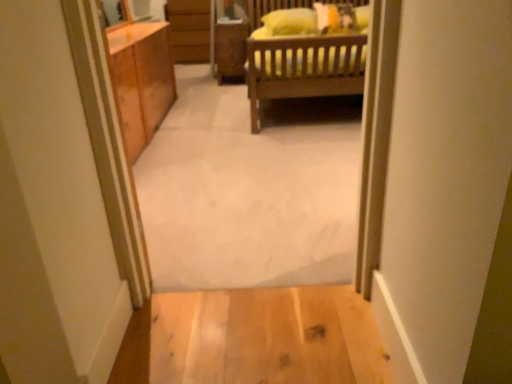
The width and height of the screenshot is (512, 384). I want to click on wooden cabinet at center, so click(230, 50).

Locate an element on the screen. Image resolution: width=512 pixels, height=384 pixels. light wood floor at lower center, the 2th plain viewed from the top is located at coordinates (266, 337).

Image resolution: width=512 pixels, height=384 pixels. Describe the element at coordinates (249, 189) in the screenshot. I see `carpet at center, the first plain positioned from the top` at that location.

You are a GUI agent. You are given a task and a screenshot of the screen. Output one action in this format:
    pyautogui.click(x=<x>, y=<y>)
    Task: Click on the yellow soft pillow at upper center
    
    Given the screenshot: What is the action you would take?
    pyautogui.click(x=290, y=22)

Image resolution: width=512 pixels, height=384 pixels. I want to click on wooden cabinet at center, so click(230, 50).

Is light wood floor at lower center, arranged as the 1th plain when ordered from the bottom, at the back of yellow soft pillow at upper center?

No, yellow soft pillow at upper center is not facing the opposite direction of light wood floor at lower center, arranged as the 1th plain when ordered from the bottom.

In terms of size, does yellow soft pillow at upper center appear bigger or smaller than light wood floor at lower center, the 2th plain viewed from the top?

yellow soft pillow at upper center is bigger than light wood floor at lower center, the 2th plain viewed from the top.

Who is shorter, yellow soft pillow at upper center or light wood floor at lower center, the 2th plain viewed from the top?

Standing shorter between the two is light wood floor at lower center, the 2th plain viewed from the top.

Considering the relative positions of yellow soft pillow at upper center and light wood floor at lower center, the 2th plain viewed from the top, in the image provided, is yellow soft pillow at upper center behind light wood floor at lower center, the 2th plain viewed from the top,?

Yes.

Can you confirm if yellow soft pillow at upper center is wider than wooden cabinet at center?

Yes.

How far apart are yellow soft pillow at upper center and wooden cabinet at center?

A distance of 5.47 feet exists between yellow soft pillow at upper center and wooden cabinet at center.

Is point (289, 19) farther from viewer compared to point (234, 37)?

No, it is in front of (234, 37).

Which object is further away from the camera, yellow soft pillow at upper center or wooden cabinet at center?

wooden cabinet at center is further from the camera.

From a real-world perspective, which object stands above the other?

yellow soft pillow at upper center, from a real-world perspective.

Does light wood floor at lower center, the 2th plain viewed from the top, appear on the left side of yellow soft pillow at upper center?

Correct, you'll find light wood floor at lower center, the 2th plain viewed from the top, to the left of yellow soft pillow at upper center.

Relative to yellow soft pillow at upper center, is light wood floor at lower center, the 2th plain viewed from the top, in front or behind?

light wood floor at lower center, the 2th plain viewed from the top, is positioned closer to the viewer than yellow soft pillow at upper center.

Would you say light wood floor at lower center, the 2th plain viewed from the top, contains yellow soft pillow at upper center?

Actually, yellow soft pillow at upper center is outside light wood floor at lower center, the 2th plain viewed from the top.

Is carpet at center, which is the second plain from bottom to top, turned away from light wood floor at lower center, the 2th plain viewed from the top?

Yes, carpet at center, which is the second plain from bottom to top, is positioned with its back facing light wood floor at lower center, the 2th plain viewed from the top.

Does carpet at center, the first plain positioned from the top, have a lesser width compared to light wood floor at lower center, the 2th plain viewed from the top?

Indeed, carpet at center, the first plain positioned from the top, has a lesser width compared to light wood floor at lower center, the 2th plain viewed from the top.

Is carpet at center, the first plain positioned from the top, to the right of light wood floor at lower center, arranged as the 1th plain when ordered from the bottom, from the viewer's perspective?

Incorrect, carpet at center, the first plain positioned from the top, is not on the right side of light wood floor at lower center, arranged as the 1th plain when ordered from the bottom.

Considering the relative sizes of carpet at center, the first plain positioned from the top, and light wood floor at lower center, arranged as the 1th plain when ordered from the bottom, in the image provided, is carpet at center, the first plain positioned from the top, taller than light wood floor at lower center, arranged as the 1th plain when ordered from the bottom,?

Yes, carpet at center, the first plain positioned from the top, is taller than light wood floor at lower center, arranged as the 1th plain when ordered from the bottom.

From a real-world perspective, which object rests below the other?

In real-world perspective, carpet at center, the first plain positioned from the top, is lower.

Is carpet at center, the first plain positioned from the top, directly adjacent to yellow soft pillow at upper center?

No.

Between carpet at center, which is the second plain from bottom to top, and yellow soft pillow at upper center, which one has smaller width?

With smaller width is carpet at center, which is the second plain from bottom to top.

Considering the relative positions of carpet at center, which is the second plain from bottom to top, and yellow soft pillow at upper center in the image provided, is carpet at center, which is the second plain from bottom to top, behind yellow soft pillow at upper center?

That is False.

From the image's perspective, is light wood floor at lower center, arranged as the 1th plain when ordered from the bottom, above or below carpet at center, which is the second plain from bottom to top?

light wood floor at lower center, arranged as the 1th plain when ordered from the bottom, is situated lower than carpet at center, which is the second plain from bottom to top, in the image.

Which is behind, point (191, 373) or point (328, 185)?

The point (328, 185) is behind.

Who is smaller, light wood floor at lower center, the 2th plain viewed from the top, or carpet at center, which is the second plain from bottom to top?

With smaller size is light wood floor at lower center, the 2th plain viewed from the top.

At what (x,y) coordinates should I click in order to perform the action: click on cabinetry below the yellow soft pillow at upper center (from the image's perspective). Please return your answer as a coordinate pair (x, y). The width and height of the screenshot is (512, 384). Looking at the image, I should click on (230, 50).

Which of these two, wooden cabinet at center or yellow soft pillow at upper center, is wider?

With larger width is yellow soft pillow at upper center.

Is wooden cabinet at center not within yellow soft pillow at upper center?

Yes, wooden cabinet at center is located beyond the bounds of yellow soft pillow at upper center.

Is wooden cabinet at center next to yellow soft pillow at upper center?

No, wooden cabinet at center is not next to yellow soft pillow at upper center.

Identify the location of pillow above the light wood floor at lower center, arranged as the 1th plain when ordered from the bottom (from the image's perspective). coord(290,22).

I want to click on cabinetry on the left of yellow soft pillow at upper center, so click(230, 50).

Based on the photo, based on their spatial positions, is carpet at center, which is the second plain from bottom to top, or yellow soft pillow at upper center further from wooden cabinet at center?

carpet at center, which is the second plain from bottom to top, lies further to wooden cabinet at center than the other object.

Based on their spatial positions, is carpet at center, the first plain positioned from the top, or light wood floor at lower center, arranged as the 1th plain when ordered from the bottom, closer to wooden cabinet at center?

Among the two, carpet at center, the first plain positioned from the top, is located nearer to wooden cabinet at center.

In the scene shown: Looking at the image, which one is located closer to light wood floor at lower center, arranged as the 1th plain when ordered from the bottom, wooden cabinet at center or carpet at center, which is the second plain from bottom to top?

carpet at center, which is the second plain from bottom to top.

When comparing their distances from yellow soft pillow at upper center, does carpet at center, which is the second plain from bottom to top, or wooden cabinet at center seem closer?

carpet at center, which is the second plain from bottom to top, is closer to yellow soft pillow at upper center.

Looking at the image, which one is located further to carpet at center, which is the second plain from bottom to top, wooden cabinet at center or light wood floor at lower center, arranged as the 1th plain when ordered from the bottom?

wooden cabinet at center is further to carpet at center, which is the second plain from bottom to top.

Looking at the image, which one is located closer to light wood floor at lower center, the 2th plain viewed from the top, wooden cabinet at center or yellow soft pillow at upper center?

yellow soft pillow at upper center is closer to light wood floor at lower center, the 2th plain viewed from the top.

Based on their spatial positions, is wooden cabinet at center or light wood floor at lower center, arranged as the 1th plain when ordered from the bottom, further from yellow soft pillow at upper center?

light wood floor at lower center, arranged as the 1th plain when ordered from the bottom, is further to yellow soft pillow at upper center.

Estimate the real-world distances between objects in this image. Which object is further from yellow soft pillow at upper center, wooden cabinet at center or carpet at center, which is the second plain from bottom to top?

wooden cabinet at center.

You are a GUI agent. You are given a task and a screenshot of the screen. Output one action in this format:
    pyautogui.click(x=<x>, y=<y>)
    Task: Click on the pillow between light wood floor at lower center, arranged as the 1th plain when ordered from the bottom, and wooden cabinet at center, along the z-axis
    The width and height of the screenshot is (512, 384).
    Given the screenshot: What is the action you would take?
    pyautogui.click(x=290, y=22)

Image resolution: width=512 pixels, height=384 pixels. What are the coordinates of `plain positioned between carpet at center, which is the second plain from bottom to top, and yellow soft pillow at upper center from near to far` in the screenshot? It's located at (266, 337).

Image resolution: width=512 pixels, height=384 pixels. I want to click on pillow positioned between carpet at center, which is the second plain from bottom to top, and wooden cabinet at center from near to far, so click(x=290, y=22).

Find the location of a particular element. plain positioned between carpet at center, the first plain positioned from the top, and wooden cabinet at center from near to far is located at coordinates (266, 337).